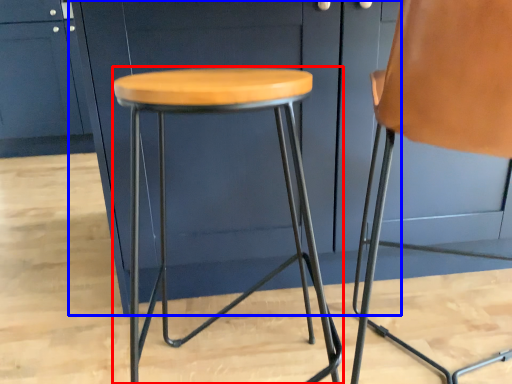
Question: Which of the following is the closest to the observer, stool (highlighted by a red box) or cabinetry (highlighted by a blue box)?

Choices:
 (A) stool
 (B) cabinetry

Answer: (A)